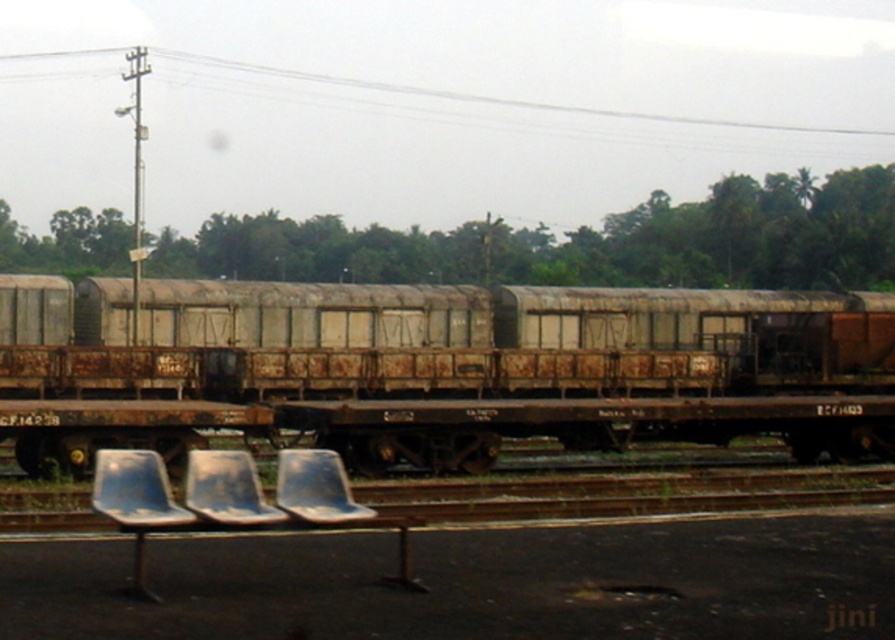
From the picture: Can you confirm if metallic gray chair at lower center is wider than white plastic chair at lower center?

Correct, the width of metallic gray chair at lower center exceeds that of white plastic chair at lower center.

Does metallic gray chair at lower center have a greater height compared to white plastic chair at lower center?

Yes, metallic gray chair at lower center is taller than white plastic chair at lower center.

Who is more distant from viewer, (258, 509) or (299, 500)?

The point (299, 500) is more distant.

The image size is (895, 640). I want to click on metallic gray chair at lower center, so click(226, 490).

Does rusty metal train car at center have a lesser width compared to blue plastic chair at lower left?

Incorrect, rusty metal train car at center's width is not less than blue plastic chair at lower left's.

Between point (655, 308) and point (166, 474), which one is positioned behind?

The point (655, 308) is behind.

This screenshot has height=640, width=895. In order to click on rusty metal train car at center in this screenshot , I will do `click(433, 339)`.

Is blue plastic chair at lower left wider than metallic gray chair at lower center?

Indeed, blue plastic chair at lower left has a greater width compared to metallic gray chair at lower center.

Locate an element on the screen. This screenshot has width=895, height=640. blue plastic chair at lower left is located at coordinates (135, 502).